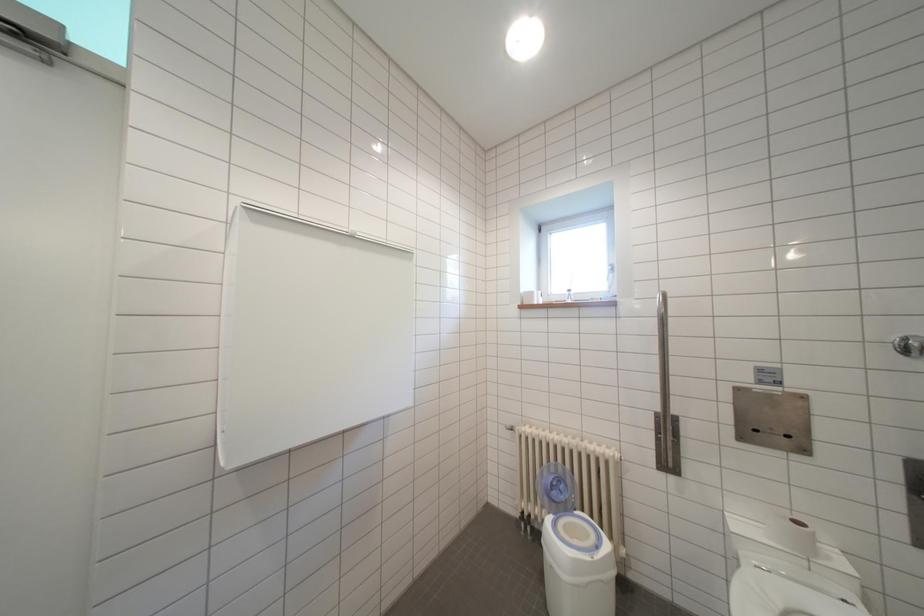
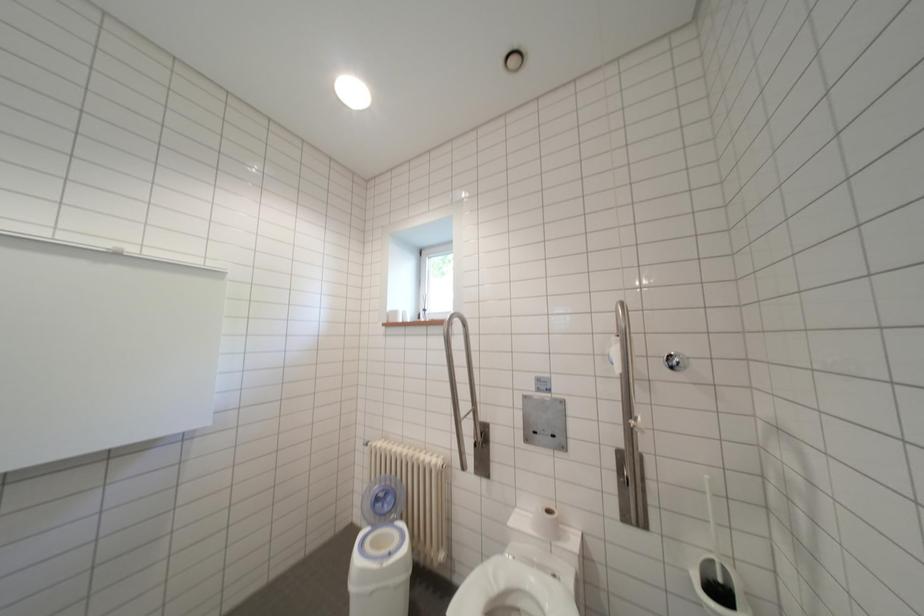
Question: The images are taken continuously from a first-person perspective. In which direction are you moving?

Choices:
 (A) Left
 (B) Right
 (C) Forward
 (D) Backward

Answer: (B)